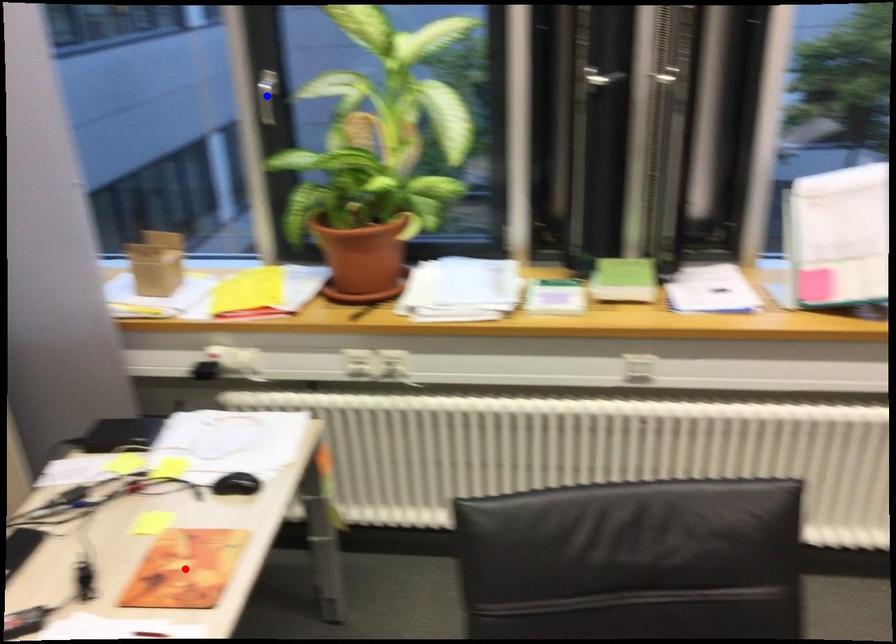
Question: In the image, two points are highlighted. Which point is nearer to the camera? Reply with the corresponding letter.

Choices:
 (A) blue point
 (B) red point

Answer: (B)